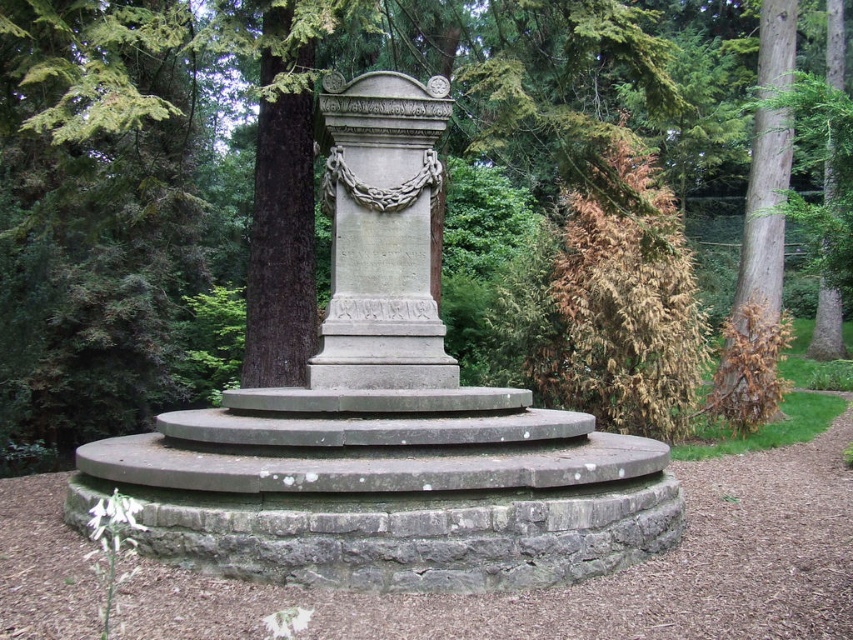
You are standing in the garden and want to take a photo of the gray stone monument at center without the green textured tree at center blocking the view. Which direction should you move to ensure the tree is out of frame?

The green textured tree at center is located above the gray stone monument at center, so you should move downward or look downward to avoid the tree blocking the monument.